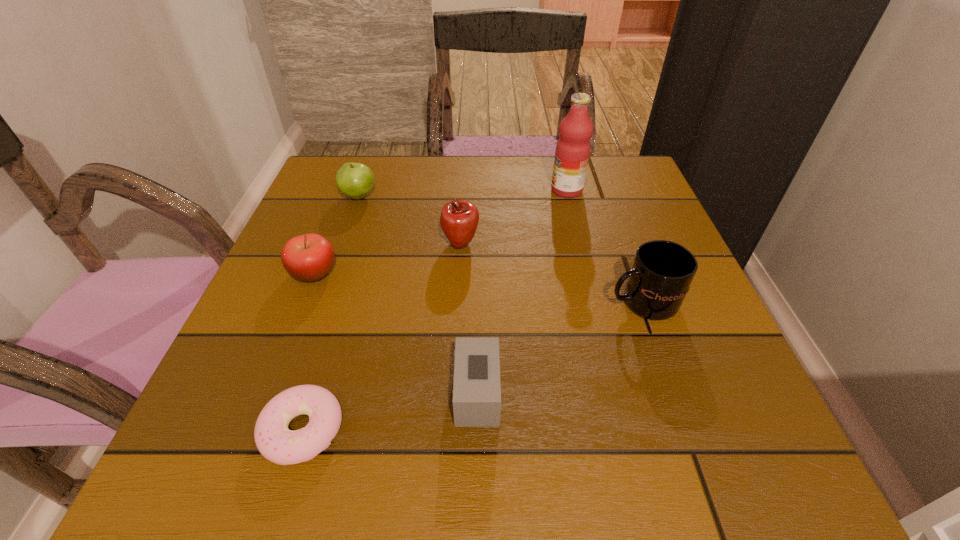
The height and width of the screenshot is (540, 960). I want to click on the tallest object, so click(572, 152).

Identify the location of the rightmost apple. The image size is (960, 540). (459, 219).

The image size is (960, 540). What are the coordinates of `mug` in the screenshot? It's located at (662, 271).

Find the location of a particular element. the farthest apple is located at coordinates (355, 180).

You are a GUI agent. You are given a task and a screenshot of the screen. Output one action in this format:
    pyautogui.click(x=<x>, y=<y>)
    Task: Click on the alarm clock
    The image size is (960, 540).
    Given the screenshot: What is the action you would take?
    pyautogui.click(x=476, y=391)

Find the location of a particular element. Image resolution: width=960 pixels, height=540 pixels. the shortest object is located at coordinates (274, 440).

Identify the location of free location located 0.310m on the label of the fruit juice. Image resolution: width=960 pixels, height=540 pixels. (423, 190).

The width and height of the screenshot is (960, 540). Identify the location of free region located 0.370m on the label of the fruit juice. (399, 190).

Locate an element on the screen. The width and height of the screenshot is (960, 540). vacant position located 0.390m on the label of the fruit juice is located at coordinates (391, 190).

Find the location of a particular element. free space located on the front of the rightmost apple is located at coordinates (455, 348).